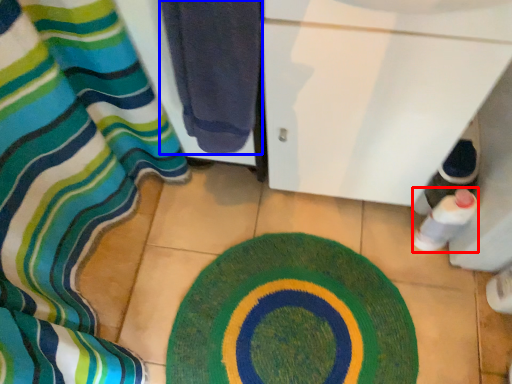
Question: Among these objects, which one is farthest to the camera, bottle (highlighted by a red box) or towel (highlighted by a blue box)?

Choices:
 (A) bottle
 (B) towel

Answer: (A)